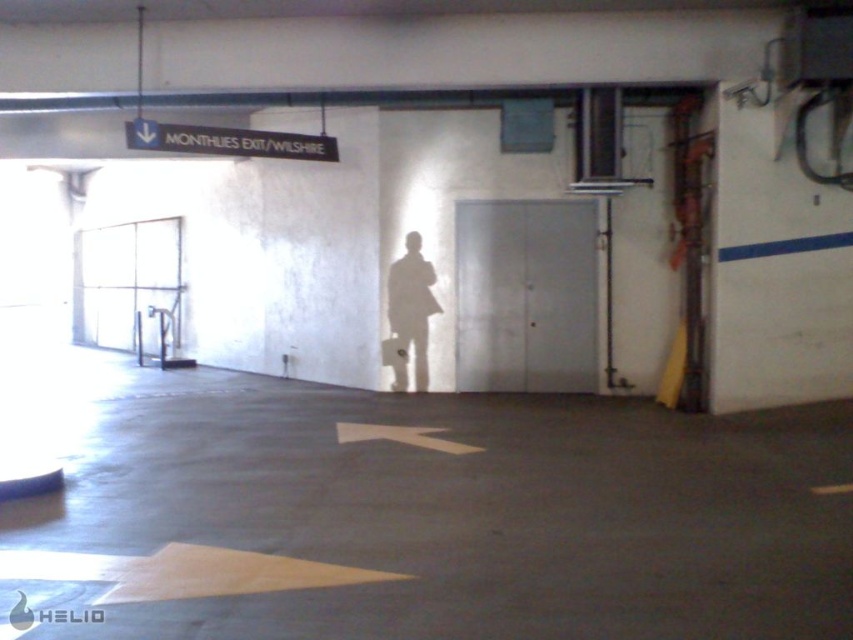
Question: Does concrete floor at center appear on the right side of transparent glass elevator at left?

Choices:
 (A) yes
 (B) no

Answer: (A)

Question: Which of the following is the farthest from the observer?

Choices:
 (A) (583, 269)
 (B) (488, 486)
 (C) (408, 330)
 (D) (180, 342)

Answer: (D)

Question: Which of the following is the farthest from the observer?

Choices:
 (A) transparent glass elevator at left
 (B) metallic gray elevator at center
 (C) concrete floor at center

Answer: (A)

Question: Is the position of metallic gray elevator at center less distant than that of white matte coat at center?

Choices:
 (A) no
 (B) yes

Answer: (B)

Question: Does concrete floor at center lie in front of transparent glass elevator at left?

Choices:
 (A) yes
 (B) no

Answer: (A)

Question: Which is nearer to the white plastic sign at upper center?

Choices:
 (A) metallic gray elevator at center
 (B) transparent glass elevator at left
 (C) concrete floor at center
 (D) white matte coat at center

Answer: (D)